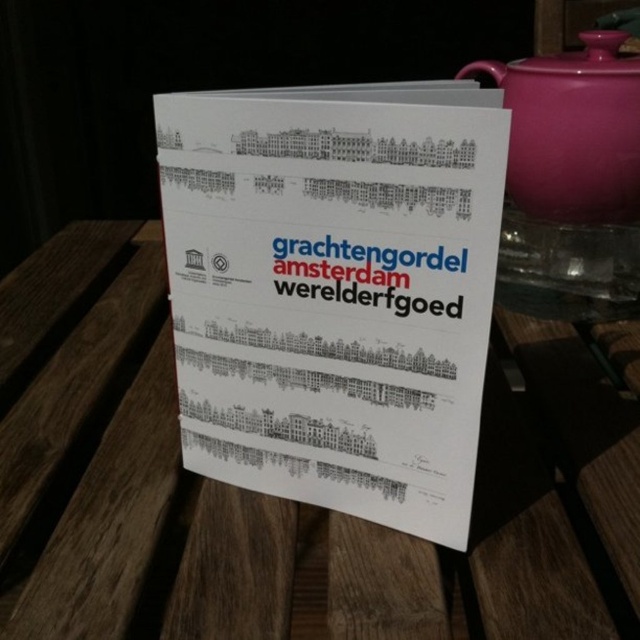
Is point (426, 342) positioned in front of point (609, 173)?

Yes, it is.

Is white paper sign at center to the left of matte pink ceramic teapot at upper right from the viewer's perspective?

Correct, you'll find white paper sign at center to the left of matte pink ceramic teapot at upper right.

What do you see at coordinates (336, 291) in the screenshot? Image resolution: width=640 pixels, height=640 pixels. I see `white paper sign at center` at bounding box center [336, 291].

Where is `white paper sign at center`? white paper sign at center is located at coordinates (336, 291).

Who is shorter, wooden picnic table at center or white paper sign at center?

Standing shorter between the two is wooden picnic table at center.

Is wooden picnic table at center below white paper sign at center?

Yes.

Is point (392, 618) in front of point (403, 289)?

Yes, point (392, 618) is closer to viewer.

You are a GUI agent. You are given a task and a screenshot of the screen. Output one action in this format:
    pyautogui.click(x=<x>, y=<y>)
    Task: Click on the wooden picnic table at center
    
    Given the screenshot: What is the action you would take?
    pyautogui.click(x=284, y=499)

Is wooden picnic table at center to the left of matte pink ceramic teapot at upper right from the viewer's perspective?

Indeed, wooden picnic table at center is positioned on the left side of matte pink ceramic teapot at upper right.

This screenshot has height=640, width=640. What do you see at coordinates (284, 499) in the screenshot? I see `wooden picnic table at center` at bounding box center [284, 499].

The height and width of the screenshot is (640, 640). Find the location of `wooden picnic table at center`. wooden picnic table at center is located at coordinates (284, 499).